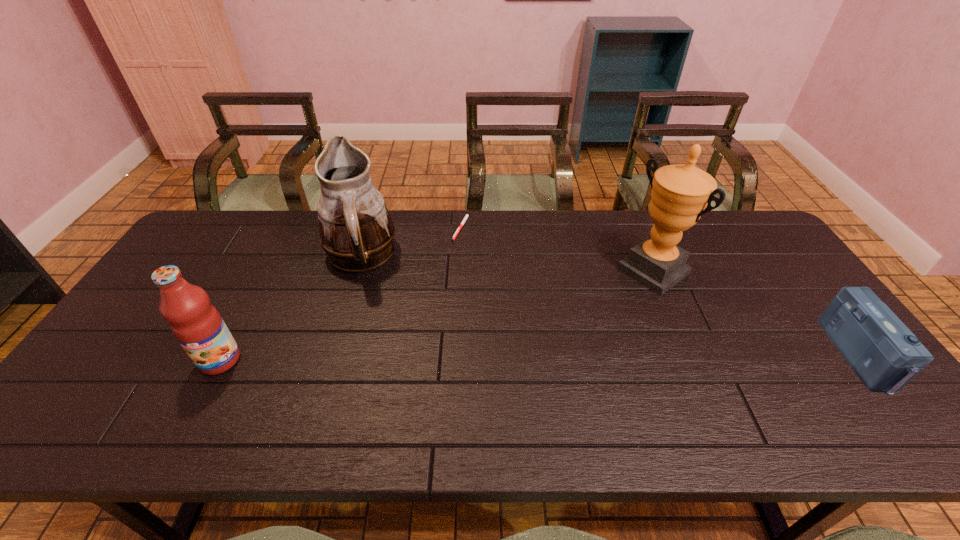
Locate an element on the screen. award situated at the far edge is located at coordinates (680, 193).

The image size is (960, 540). Identify the location of fruit juice that is at the near edge. (197, 325).

Identify the location of camera situated at the near edge. (885, 355).

Find the location of a particular element. object that is at the right edge is located at coordinates (885, 355).

Where is `object that is at the near right corner`? Image resolution: width=960 pixels, height=540 pixels. object that is at the near right corner is located at coordinates (885, 355).

In the image, there is a desktop. Identify the location of vacant area at the far edge. (409, 234).

At what (x,y) coordinates should I click in order to perform the action: click on vacant area at the near edge. Please return your answer as a coordinate pair (x, y). Looking at the image, I should click on (743, 392).

Identify the location of free space at the left edge of the desktop. (211, 287).

Identify the location of vacant region at the right edge of the desktop. (745, 279).

This screenshot has width=960, height=540. What are the coordinates of `vacant space at the far left corner of the desktop` in the screenshot? It's located at (245, 210).